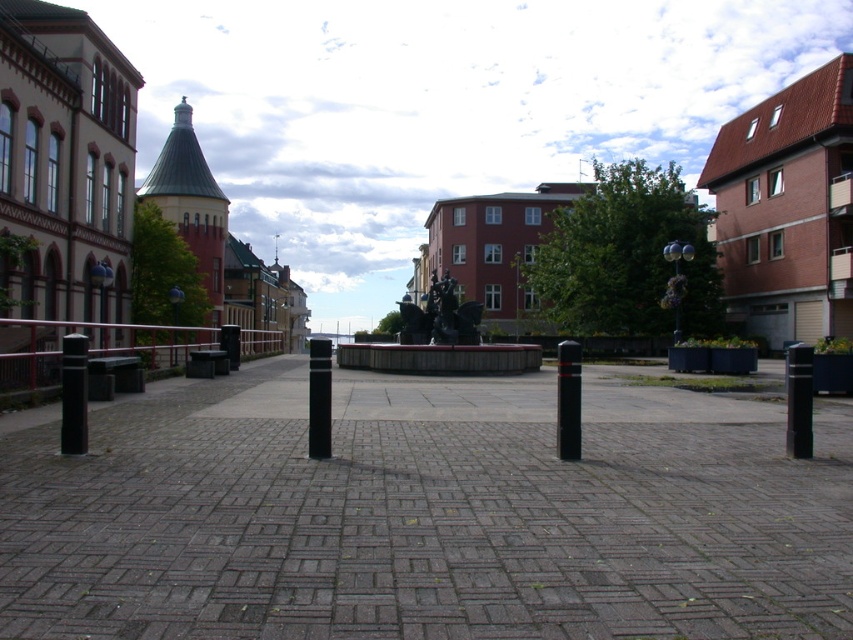
Question: Can you confirm if black matte pole at left is smaller than black rubber pole at center?

Choices:
 (A) yes
 (B) no

Answer: (A)

Question: Which object is positioned closest to the black polished pole at center?

Choices:
 (A) black matte pole at right
 (B) red painted metal rail at left

Answer: (B)

Question: Is gray concrete pavement at center below red painted metal rail at left?

Choices:
 (A) no
 (B) yes

Answer: (B)

Question: Is black matte pole at left thinner than black polished pole at center?

Choices:
 (A) no
 (B) yes

Answer: (B)

Question: Which object is the closest to the gray concrete pavement at center?

Choices:
 (A) black polished pole at center
 (B) black matte pole at left
 (C) black rubber pole at center
 (D) black matte pole at right

Answer: (A)

Question: Which object appears closest to the camera in this image?

Choices:
 (A) black polished pole at center
 (B) black matte pole at right
 (C) red painted metal rail at left
 (D) black matte pole at left

Answer: (D)